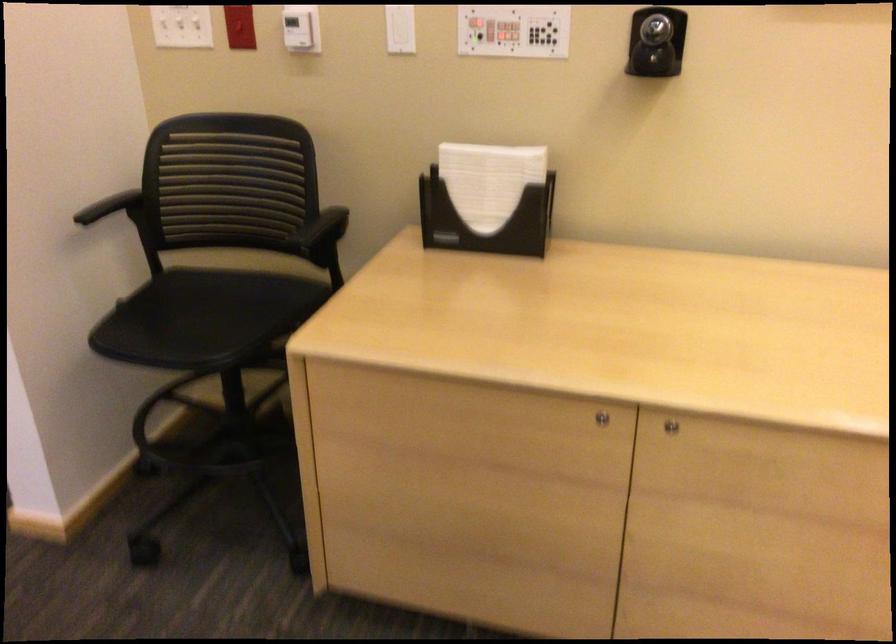
In order to click on red wall switch in this screenshot , I will do `click(239, 26)`.